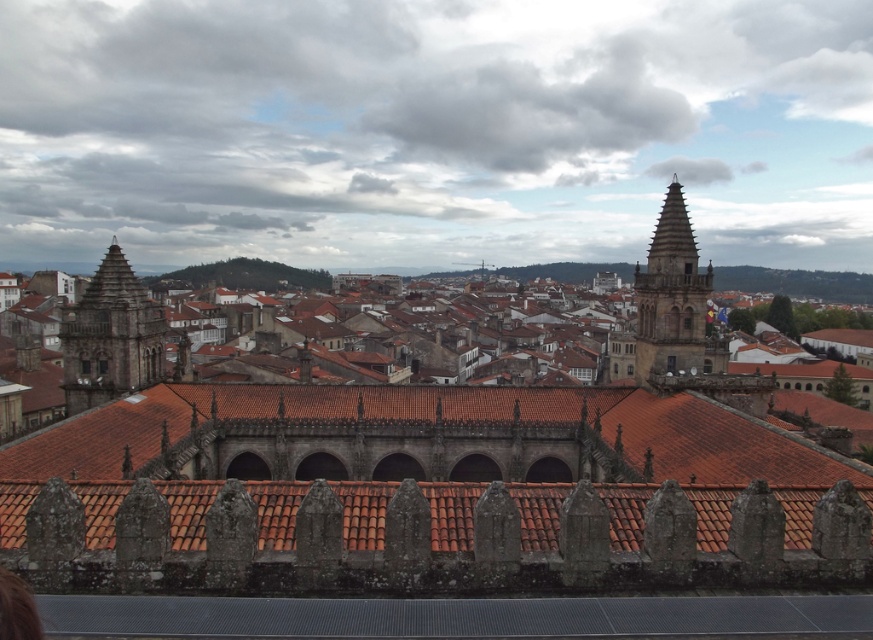
You are a city planner assessing the feasibility of installing a new communication antenna between the dark brown stone tower at left and the brown stone tower at upper right. Given that the minimum required distance for safe installation is 50 meters, can the antenna be placed between them?

The distance between the dark brown stone tower at left and the brown stone tower at upper right is 67.84 meters, which exceeds the 50 meters requirement. Therefore, the antenna can be safely installed between them.

You are standing at the center of the stone wall in the foreground. You want to locate the dark brown stone tower at left. In which direction should you look relative to your position?

The dark brown stone tower at left is located at coordinates point (111,337), which would be to your left side relative to your position at the center of the stone wall.